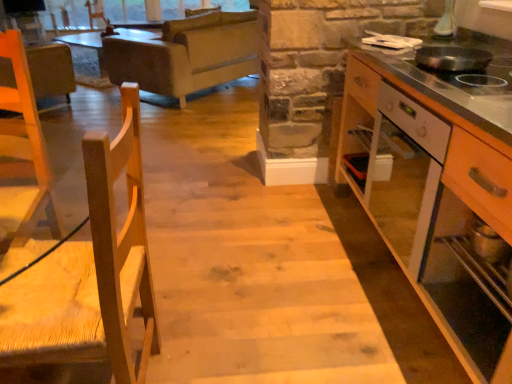
Question: Can you confirm if natural wood chair at left is wider than wooden cabinet at right?

Choices:
 (A) yes
 (B) no

Answer: (B)

Question: Can you confirm if natural wood chair at left is smaller than wooden cabinet at right?

Choices:
 (A) no
 (B) yes

Answer: (B)

Question: From the image's perspective, does natural wood chair at left appear lower than wooden cabinet at right?

Choices:
 (A) yes
 (B) no

Answer: (A)

Question: Is natural wood chair at left oriented towards wooden cabinet at right?

Choices:
 (A) yes
 (B) no

Answer: (B)

Question: Considering the relative positions of natural wood chair at left and wooden cabinet at right in the image provided, is natural wood chair at left to the left of wooden cabinet at right from the viewer's perspective?

Choices:
 (A) no
 (B) yes

Answer: (B)

Question: Considering the positions of natural wood chair at left and wooden cabinet at right in the image, is natural wood chair at left taller or shorter than wooden cabinet at right?

Choices:
 (A) short
 (B) tall

Answer: (B)

Question: From the image's perspective, is natural wood chair at left located above or below wooden cabinet at right?

Choices:
 (A) below
 (B) above

Answer: (A)

Question: In the image, is natural wood chair at left on the left side or the right side of wooden cabinet at right?

Choices:
 (A) left
 (B) right

Answer: (A)

Question: From a real-world perspective, is natural wood chair at left physically located above or below wooden cabinet at right?

Choices:
 (A) below
 (B) above

Answer: (B)

Question: From the image's perspective, is black matte pan at upper right positioned above or below light gray fabric couch at upper center?

Choices:
 (A) above
 (B) below

Answer: (B)

Question: Looking at their shapes, would you say black matte pan at upper right is wider or thinner than light gray fabric couch at upper center?

Choices:
 (A) wide
 (B) thin

Answer: (B)

Question: In the image, is black matte pan at upper right positioned in front of or behind light gray fabric couch at upper center?

Choices:
 (A) behind
 (B) front

Answer: (B)

Question: Is black matte pan at upper right bigger or smaller than light gray fabric couch at upper center?

Choices:
 (A) big
 (B) small

Answer: (B)

Question: Is light gray fabric couch at upper center inside or outside of brown leather armchair at upper left?

Choices:
 (A) inside
 (B) outside

Answer: (B)

Question: Is light gray fabric couch at upper center taller or shorter than brown leather armchair at upper left?

Choices:
 (A) tall
 (B) short

Answer: (B)